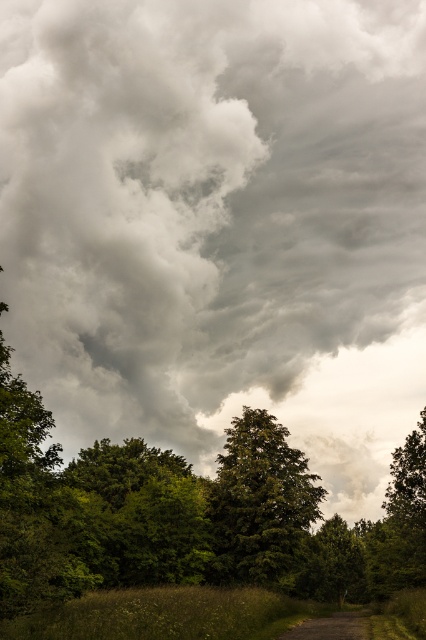
Question: Which point is closer to the camera?

Choices:
 (A) (420, 64)
 (B) (276, 442)

Answer: (B)

Question: Is the position of gray cloudy sky at upper center more distant than that of green leafy forest at center?

Choices:
 (A) yes
 (B) no

Answer: (A)

Question: Which point is farther to the camera?

Choices:
 (A) dirt/gravel path at lower center
 (B) green leafy tree at center
 (C) green leafy forest at center
 (D) gray cloudy sky at upper center

Answer: (D)

Question: Which of the following is the farthest from the observer?

Choices:
 (A) (26, 573)
 (B) (322, 332)
 (C) (336, 611)
 (D) (207, 573)

Answer: (B)

Question: Is green leafy forest at center above green leafy tree at center?

Choices:
 (A) yes
 (B) no

Answer: (B)

Question: Where is green leafy forest at center located in relation to green leafy tree at center in the image?

Choices:
 (A) right
 (B) left

Answer: (A)